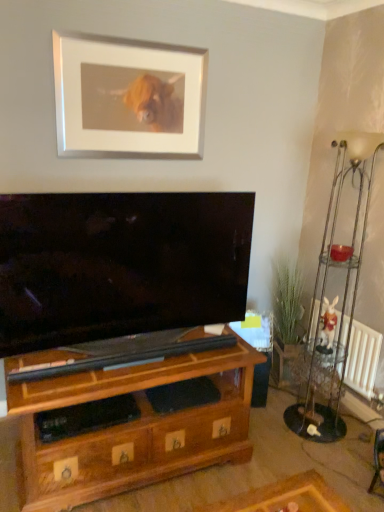
Where is `free spot to the right of metallic silver side table at right`? Image resolution: width=384 pixels, height=512 pixels. free spot to the right of metallic silver side table at right is located at coordinates (339, 421).